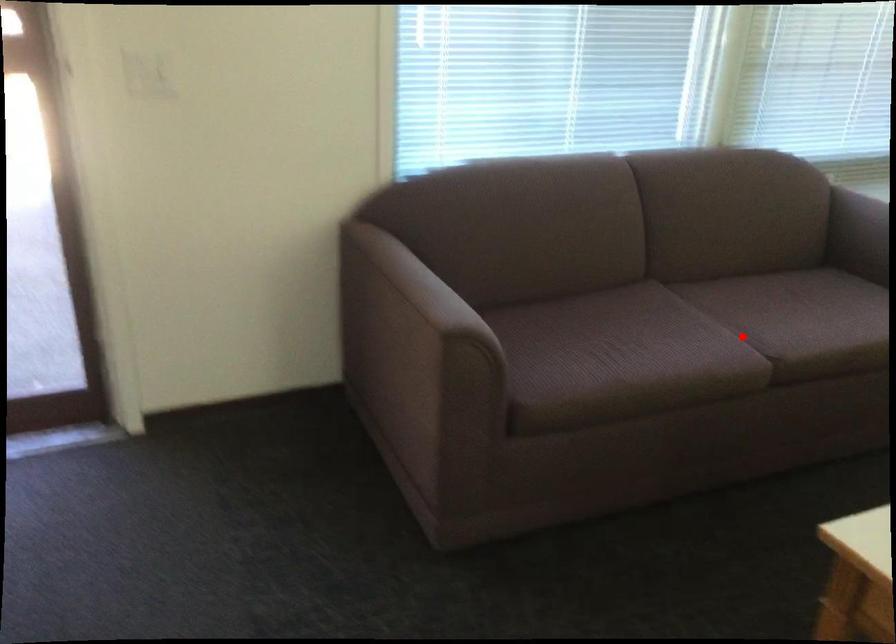
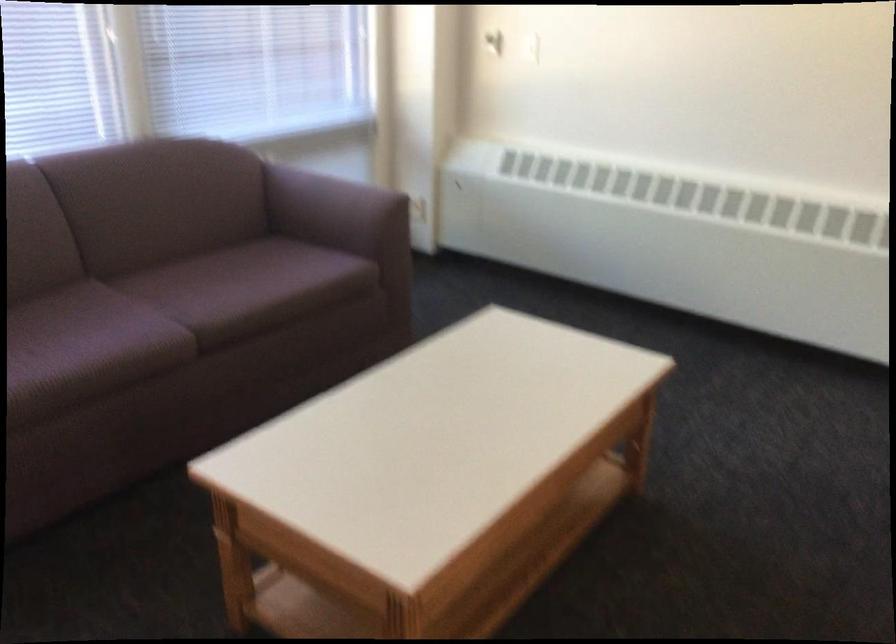
Where in the second image is the point corresponding to the highlighted location from the first image?

(168, 316)